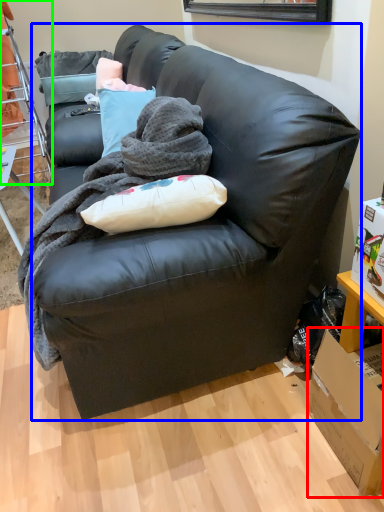
Question: Based on their relative distances, which object is nearer to box (highlighted by a red box)? Choose from studio couch (highlighted by a blue box) and bunk bed (highlighted by a green box).

Choices:
 (A) studio couch
 (B) bunk bed

Answer: (A)